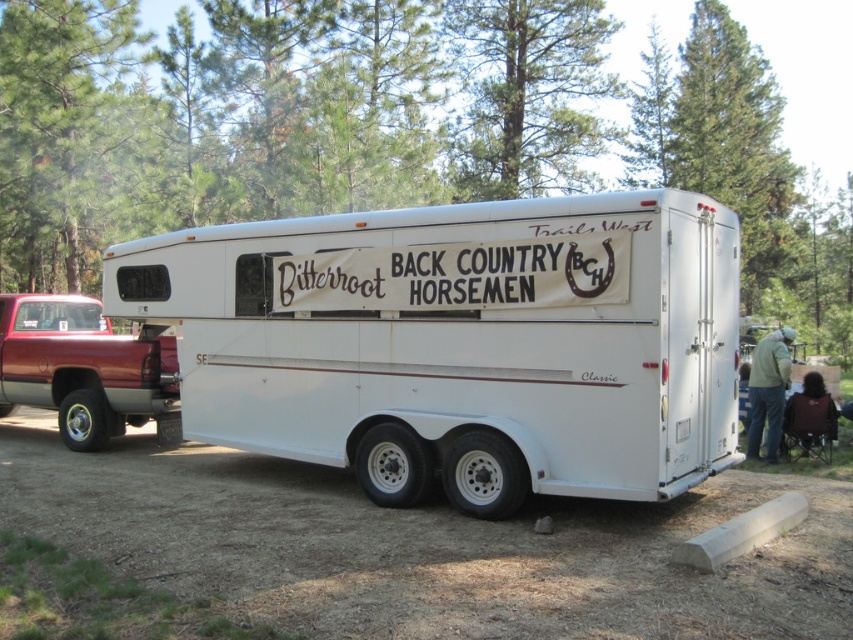
Question: Which point is farther to the camera?

Choices:
 (A) (628, 273)
 (B) (761, 342)
 (C) (57, 385)
 (D) (822, 410)

Answer: (C)

Question: Can you confirm if white matte horse trailer at center is bigger than green fabric jacket at lower right?

Choices:
 (A) yes
 (B) no

Answer: (A)

Question: Which of the following is the closest to the observer?

Choices:
 (A) shiny maroon truck at left
 (B) white matte horse trailer at center
 (C) green fabric jacket at lower right

Answer: (B)

Question: Does shiny maroon truck at left come behind green fabric jacket at lower right?

Choices:
 (A) no
 (B) yes

Answer: (A)

Question: Can you confirm if white matte horse trailer at center is positioned to the left of shiny maroon truck at left?

Choices:
 (A) yes
 (B) no

Answer: (B)

Question: Among these points, which one is nearest to the camera?

Choices:
 (A) (773, 356)
 (B) (802, 417)

Answer: (B)